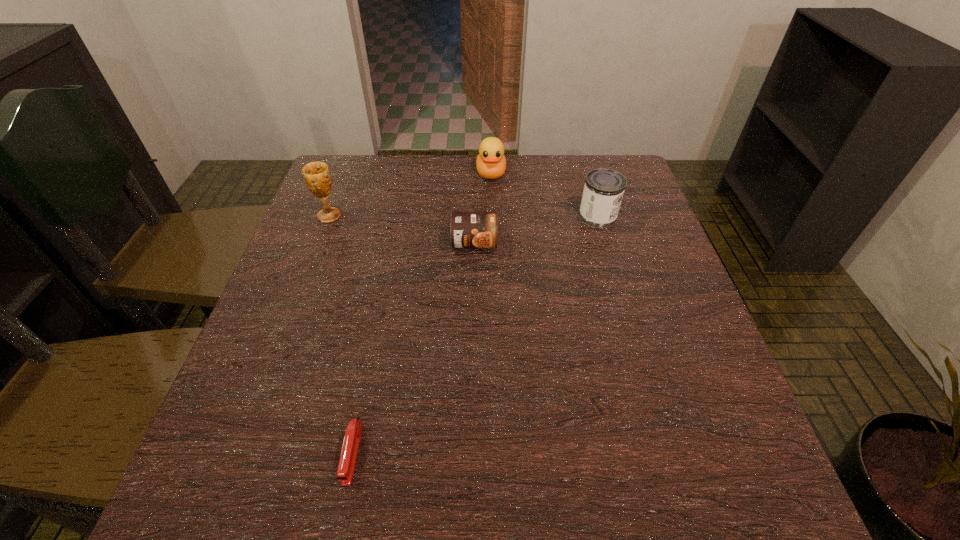
This screenshot has height=540, width=960. Identify the location of vacant space located 0.110m on the face of the farthest object. (492, 210).

Where is `free space located 0.080m on the front of the rightmost object`? free space located 0.080m on the front of the rightmost object is located at coordinates (608, 250).

What are the coordinates of `vacant space located 0.210m on the front label of the shorter can` in the screenshot? It's located at (473, 327).

Where is `object at the far edge`? Image resolution: width=960 pixels, height=540 pixels. object at the far edge is located at coordinates (491, 163).

Where is `object positioned at the near edge`? object positioned at the near edge is located at coordinates (347, 461).

Locate an element on the screen. object positioned at the left edge is located at coordinates (316, 174).

At what (x,y) coordinates should I click in order to perform the action: click on object present at the right edge. Please return your answer as a coordinate pair (x, y). This screenshot has width=960, height=540. Looking at the image, I should click on (604, 188).

In the image, there is a desktop. Where is `vacant space at the far edge`? The width and height of the screenshot is (960, 540). vacant space at the far edge is located at coordinates (442, 157).

I want to click on vacant space at the left edge of the desktop, so click(304, 365).

Find the location of a particular element. vacant space at the right edge of the desktop is located at coordinates (742, 450).